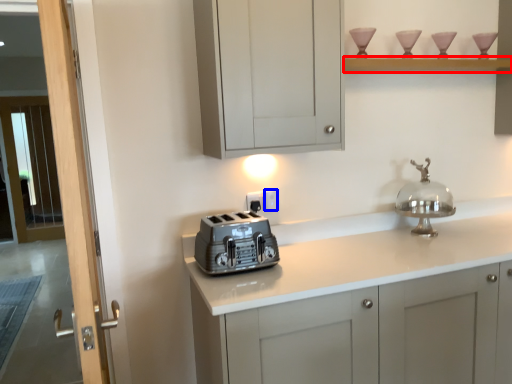
Question: Among these objects, which one is farthest to the camera, shelf (highlighted by a red box) or electric outlet (highlighted by a blue box)?

Choices:
 (A) shelf
 (B) electric outlet

Answer: (B)